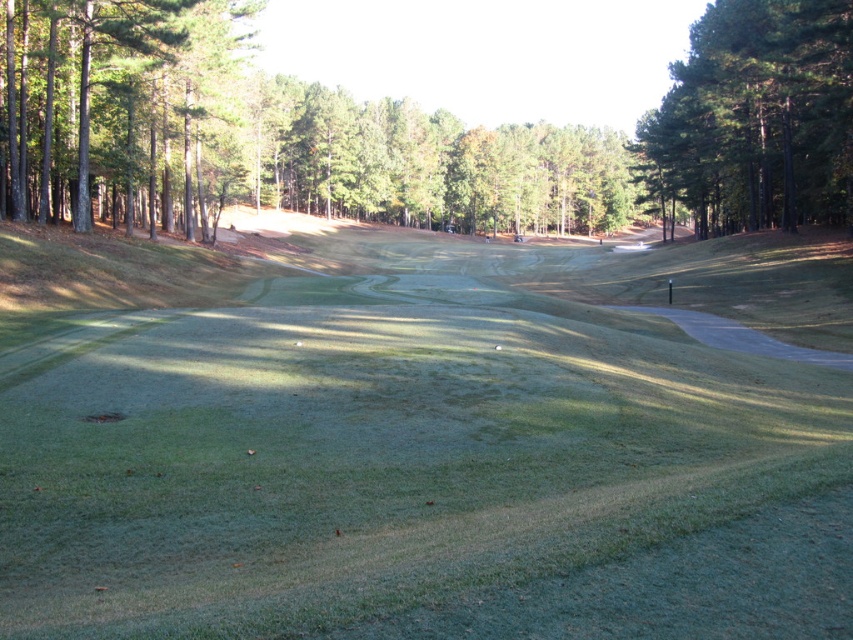
Can you confirm if green grassy field at center is positioned below green textured tree at upper right?

Correct, green grassy field at center is located below green textured tree at upper right.

Between green grassy field at center and green textured tree at upper right, which one appears on the left side from the viewer's perspective?

From the viewer's perspective, green grassy field at center appears more on the left side.

This screenshot has height=640, width=853. Identify the location of green grassy field at center. (437, 451).

In the scene shown: Who is lower down, green textured tree at upper right or green textured tree at left?

green textured tree at left

Between point (838, 36) and point (64, 49), which one is positioned behind?

Point (64, 49)

Where is `green textured tree at upper right`? green textured tree at upper right is located at coordinates (756, 116).

Which is behind, point (349, 621) or point (106, 173)?

The point (106, 173) is more distant.

Who is lower down, green grassy field at center or green textured tree at left?

green grassy field at center is lower down.

Locate an element on the screen. green grassy field at center is located at coordinates (437, 451).

Identify the location of green grassy field at center. (437, 451).